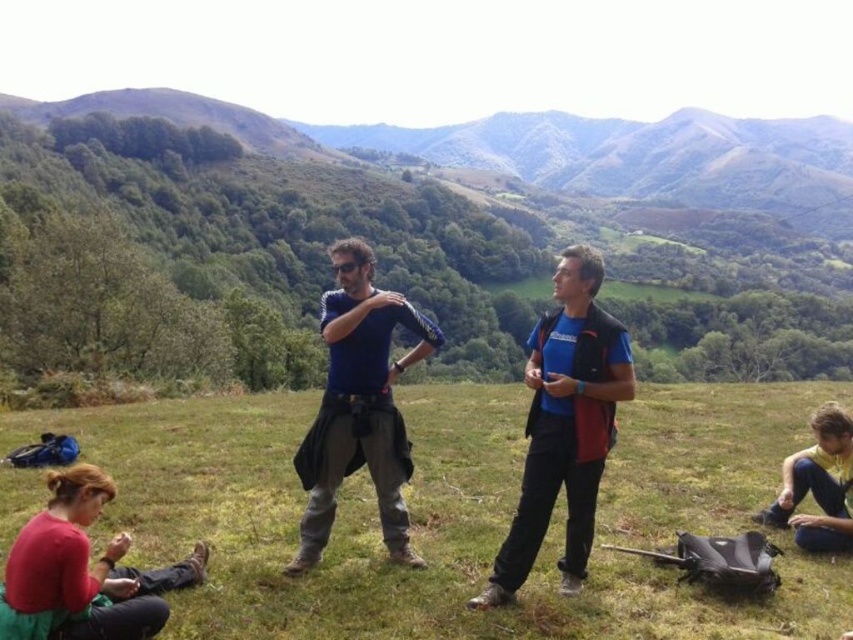
You are a photographer trying to capture a photo of the blue matte shirt at center and the yellow fabric shirt at lower right. Which of the two shirts is located to the left when framing the shot?

The blue matte shirt at center is positioned on the left side of the yellow fabric shirt at lower right, so it is located to the left in the frame.

You are a photographer trying to capture a photo of the blue matte shirt at center and the yellow fabric shirt at lower right. Based on their positions, which one is higher in the frame?

The blue matte shirt at center is above the yellow fabric shirt at lower right, so it is higher in the frame.